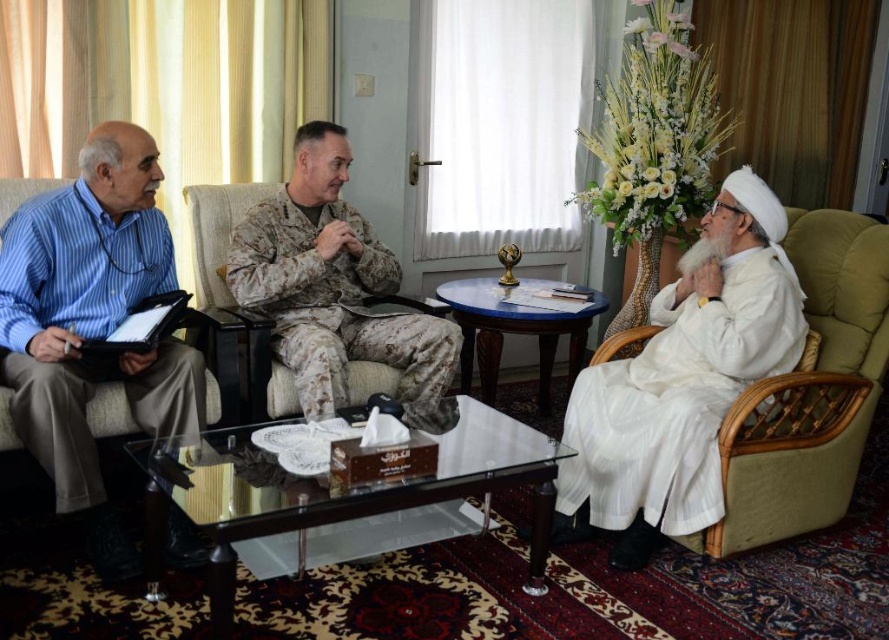
Between white silk robe at right and camouflage uniform at center, which one has more height?

camouflage uniform at center

Who is more forward, (730, 330) or (373, 328)?

Point (730, 330) is in front.

What are the coordinates of `white silk robe at right` in the screenshot? It's located at (677, 400).

Who is positioned more to the left, matte black laptop at left or white silk robe at right?

Positioned to the left is matte black laptop at left.

Who is positioned more to the right, matte black laptop at left or white silk robe at right?

white silk robe at right

You are a GUI agent. You are given a task and a screenshot of the screen. Output one action in this format:
    pyautogui.click(x=<x>, y=<y>)
    Task: Click on the matte black laptop at left
    Image resolution: width=889 pixels, height=640 pixels.
    Given the screenshot: What is the action you would take?
    pyautogui.click(x=91, y=321)

Consider the image. Does matte black laptop at left have a lesser width compared to camouflage uniform at center?

Correct, matte black laptop at left's width is less than camouflage uniform at center's.

Between point (316, 360) and point (231, 248), which one is positioned behind?

The point (231, 248) is behind.

Is point (119, 577) in front of point (343, 388)?

Yes, it is in front of point (343, 388).

Locate an element on the screen. matte black laptop at left is located at coordinates (91, 321).